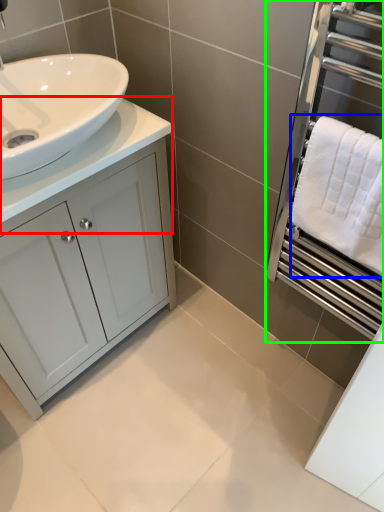
Question: Estimate the real-world distances between objects in this image. Which object is farther from counter top (highlighted by a red box), bath towel (highlighted by a blue box) or screen door (highlighted by a green box)?

Choices:
 (A) bath towel
 (B) screen door

Answer: (B)